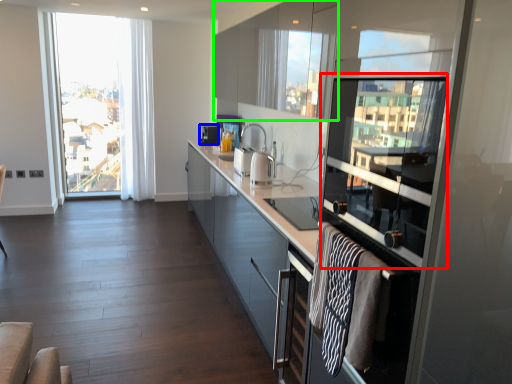
Question: Which is farther away from window screen (highlighted by a red box)? appliance (highlighted by a blue box) or cabinetry (highlighted by a green box)?

Choices:
 (A) appliance
 (B) cabinetry

Answer: (A)